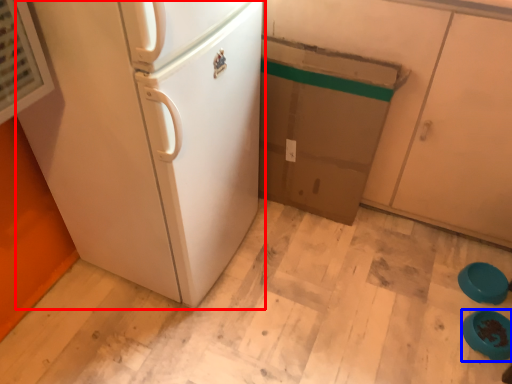
Question: Which object is further to the camera taking this photo, refrigerator (highlighted by a red box) or appliance (highlighted by a blue box)?

Choices:
 (A) refrigerator
 (B) appliance

Answer: (B)